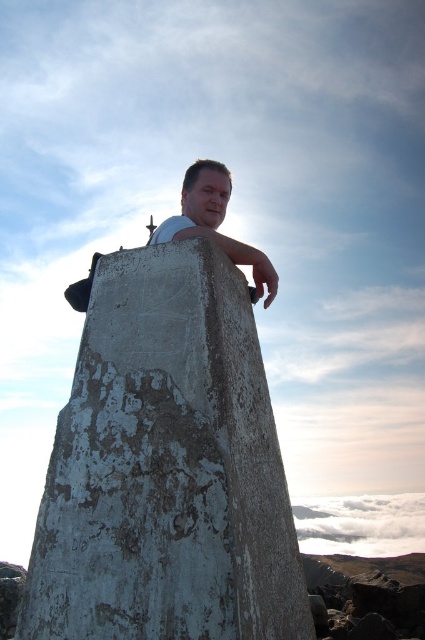
You are a photographer trying to capture the weathered concrete pillar at center. The camera you are using has a focal length of 50mm and an aperture of f2.8. Based on the coordinates provided, can you determine if the pillar is within the camera frame?

The weathered concrete pillar at center is located at coordinates point [166,467], which falls within the camera frame given the focal length of 50mm and aperture of f2.8. Therefore, the pillar is within the camera frame.

You are a drone operator trying to navigate between two points in the image. You have a drone that can only fly in straight lines. There is a large concrete pillar in the way. The points you need to reach are point (x=261, y=600) and point (x=81, y=308). According to the image, which point is closer to the front of the scene?

Point (x=261, y=600) is in front of point (x=81, y=308), so it is closer to the front of the scene.